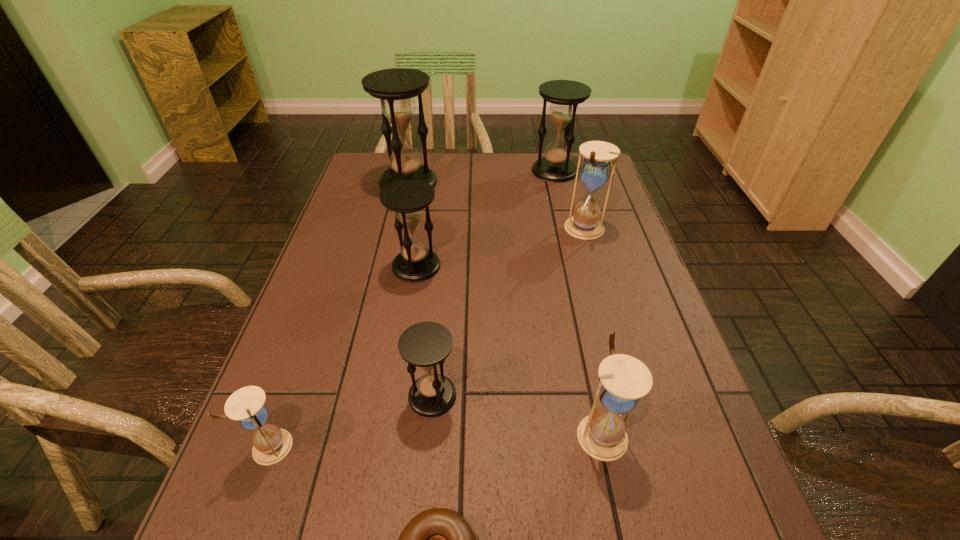
Where is `free space between the fifth nearest hourglass and the rightmost black hourglass`? The image size is (960, 540). free space between the fifth nearest hourglass and the rightmost black hourglass is located at coordinates (570, 200).

I want to click on object that is the closest to the third smallest black hourglass, so click(595, 170).

Locate which object ranks sixth in proximity to the second biggest white hourglass. Please provide its 2D coordinates. Your answer should be formatted as a tuple, i.e. [(x, y)], where the tuple contains the x and y coordinates of a point satisfying the conditions above.

[(396, 87)]

Find the location of a particular element. hourglass that is the second closest one to the rightmost black hourglass is located at coordinates (396, 87).

Image resolution: width=960 pixels, height=540 pixels. Identify the location of hourglass that is the closest to the rightmost black hourglass. (595, 170).

Point out which black hourglass is positioned as the third nearest to the rightmost black hourglass. Please provide its 2D coordinates. Your answer should be formatted as a tuple, i.e. [(x, y)], where the tuple contains the x and y coordinates of a point satisfying the conditions above.

[(426, 344)]

At what (x,y) coordinates should I click in order to perform the action: click on black hourglass that stands as the second closest to the biggest white hourglass. Please return your answer as a coordinate pair (x, y). Image resolution: width=960 pixels, height=540 pixels. Looking at the image, I should click on (407, 198).

The height and width of the screenshot is (540, 960). Identify the location of white hourglass that stands as the second closest to the smallest white hourglass. (595, 170).

I want to click on white hourglass that stands as the closest to the third farthest hourglass, so click(624, 379).

Locate an element on the screen. free space that satisfies the following two spatial constraints: 1. on the front side of the nearest black hourglass; 2. on the right side of the tallest hourglass is located at coordinates (360, 396).